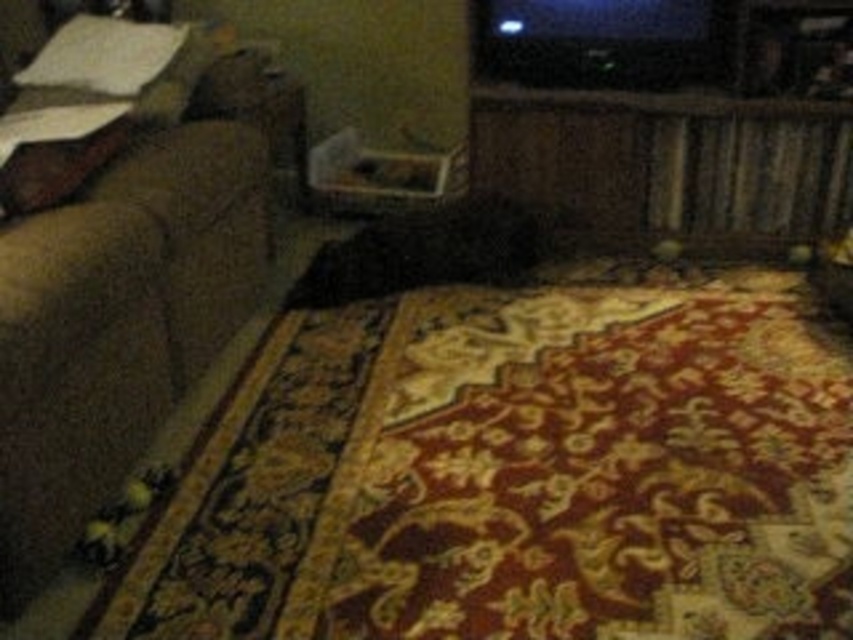
Between suede-like brown couch at left and white soft pillow at upper left, which one is positioned higher?

white soft pillow at upper left is higher up.

Between suede-like brown couch at left and white soft pillow at upper left, which one has less height?

Standing shorter between the two is white soft pillow at upper left.

Is point (64, 179) positioned in front of point (83, 80)?

Yes, point (64, 179) is in front of point (83, 80).

Locate an element on the screen. suede-like brown couch at left is located at coordinates coord(123,296).